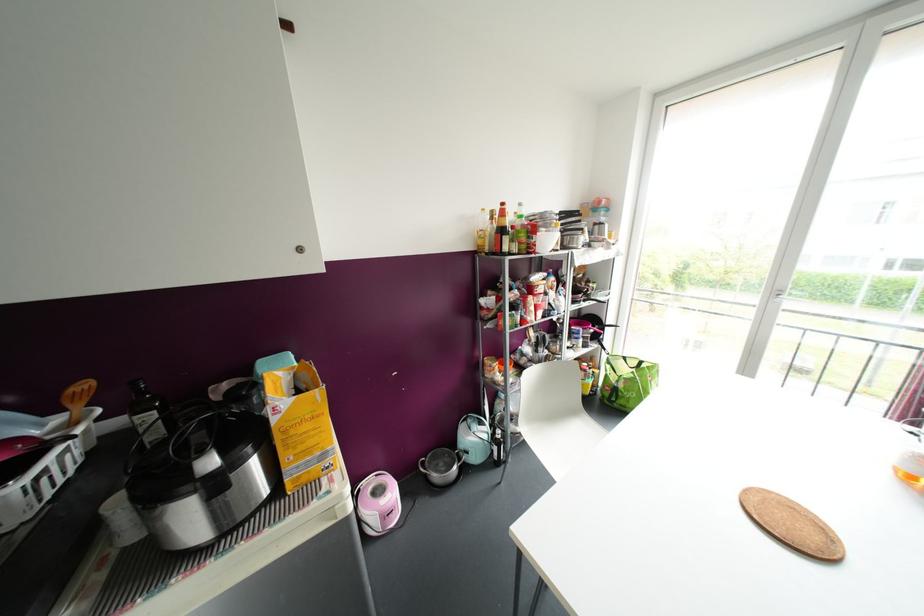
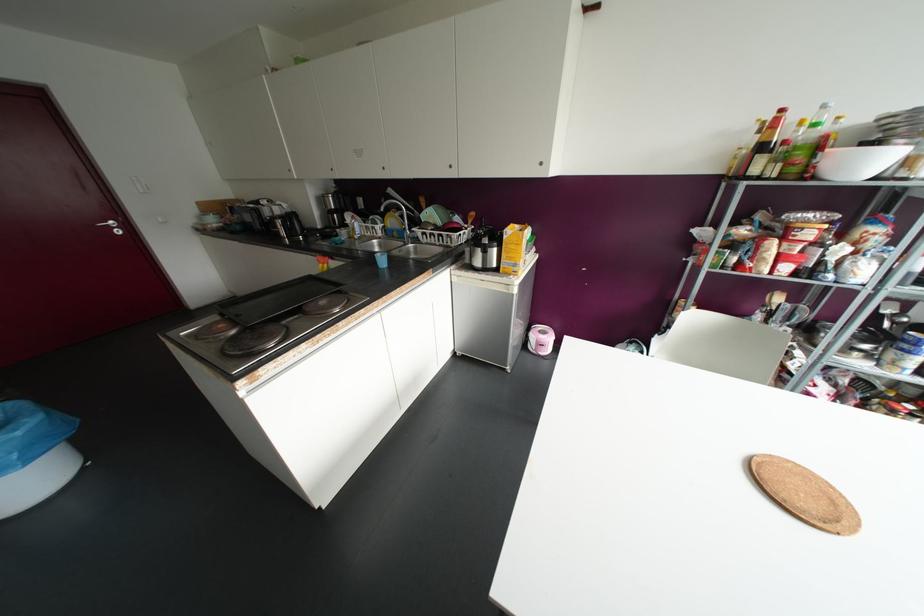
Find the pixel in the second image that matches (502,204) in the first image.

(781, 110)